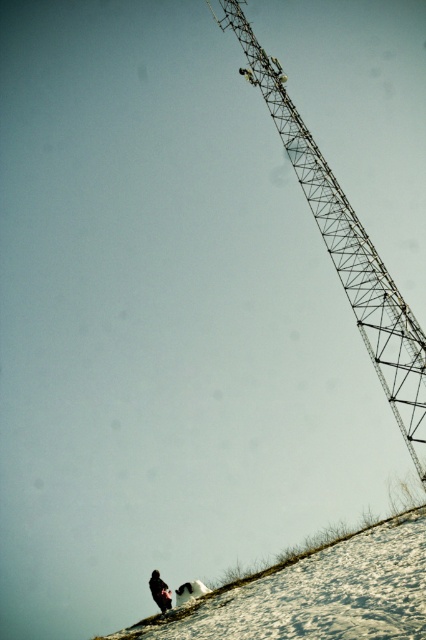
Who is higher up, metallic lattice crane at upper right or dark fabric jacket at lower center?

Positioned higher is metallic lattice crane at upper right.

Where is `metallic lattice crane at upper right`? The height and width of the screenshot is (640, 426). metallic lattice crane at upper right is located at coordinates (345, 248).